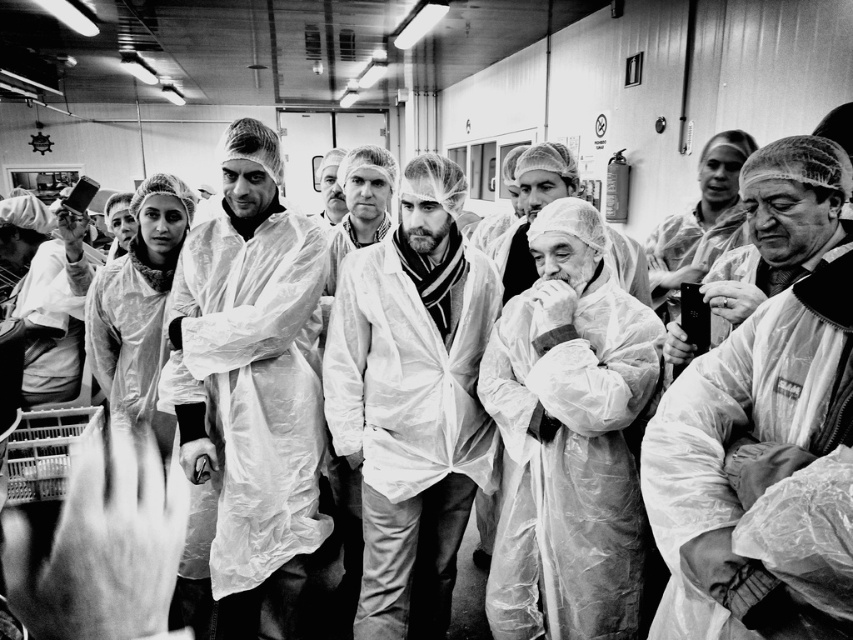
Question: Among these objects, which one is nearest to the camera?

Choices:
 (A) transparent plastic robe at center
 (B) matte white coat at center

Answer: (B)

Question: Which object is the closest to the matte white coat at center?

Choices:
 (A) transparent plastic coat at center
 (B) transparent plastic robe at center
 (C) white plastic coat at center

Answer: (B)

Question: Does matte white coat at center appear under white plastic hat at upper left?

Choices:
 (A) yes
 (B) no

Answer: (A)

Question: Can you confirm if matte white coat at center is positioned to the left of transparent plastic coat at center?

Choices:
 (A) no
 (B) yes

Answer: (A)

Question: Estimate the real-world distances between objects in this image. Which object is farther from the transparent plastic robe at center?

Choices:
 (A) white plastic hat at upper left
 (B) transparent plastic coat at center

Answer: (A)

Question: Can you confirm if matte white coat at center is positioned to the left of white plastic hat at upper left?

Choices:
 (A) yes
 (B) no

Answer: (B)